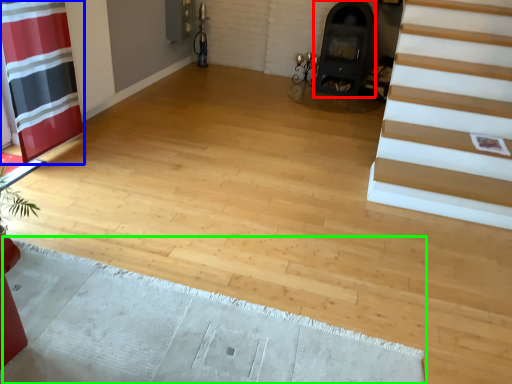
Question: Which object is the closest to the fireplace (highlighted by a red box)? Choose among these: curtain (highlighted by a blue box) or doormat (highlighted by a green box).

Choices:
 (A) curtain
 (B) doormat

Answer: (A)